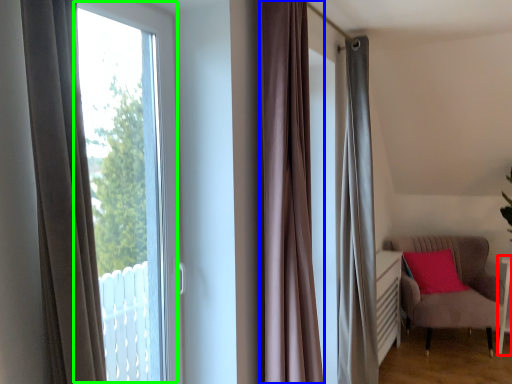
Question: Estimate the real-world distances between objects in this image. Which object is closer to side table (highlighted by a red box), curtain (highlighted by a blue box) or bay window (highlighted by a green box)?

Choices:
 (A) curtain
 (B) bay window

Answer: (A)